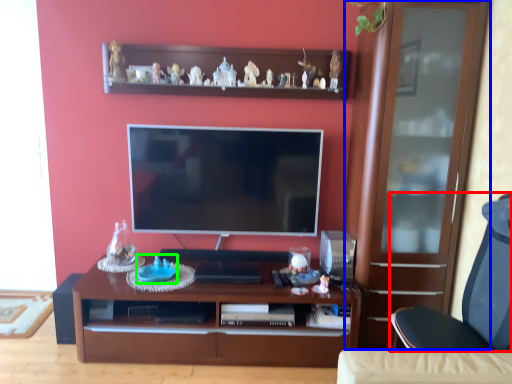
Question: Which object is the farthest from chair (highlighted by a red box)? Choose among these: cabinetry (highlighted by a blue box) or toy (highlighted by a green box).

Choices:
 (A) cabinetry
 (B) toy

Answer: (B)